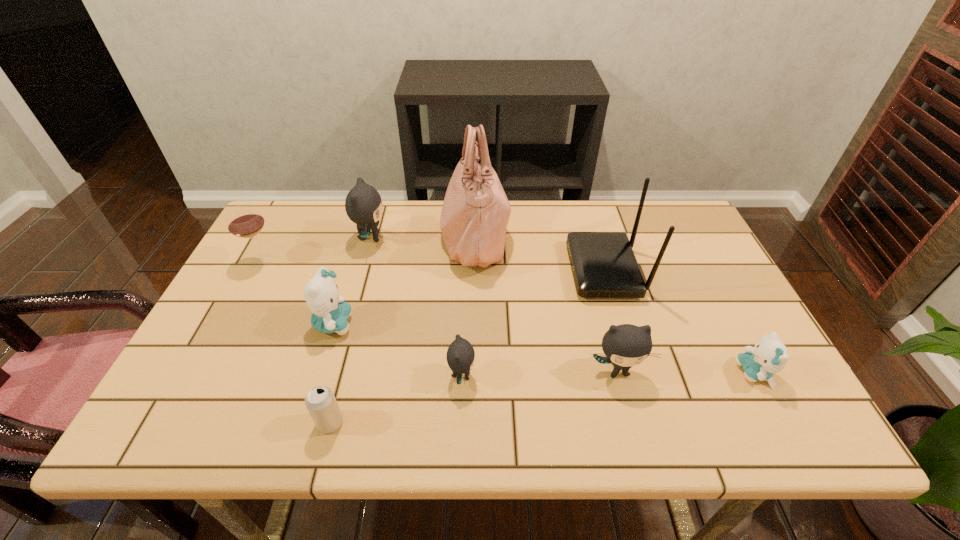
Choose which object is the third nearest neighbor to the rightmost object. Please provide its 2D coordinates. Your answer should be formatted as a tuple, i.e. [(x, y)], where the tuple contains the x and y coordinates of a point satisfying the conditions above.

[(475, 213)]

Point out which object is positioned as the second nearest to the handbag. Please provide its 2D coordinates. Your answer should be formatted as a tuple, i.e. [(x, y)], where the tuple contains the x and y coordinates of a point satisfying the conditions above.

[(603, 264)]

What are the coordinates of `kitten that is the fifth closest to the eighth shortest object` in the screenshot? It's located at (330, 314).

Image resolution: width=960 pixels, height=540 pixels. I want to click on kitten that is the second nearest to the smaller blue kitten, so click(x=460, y=356).

Locate which gray kitten is the closest to the nearest object. Please provide its 2D coordinates. Your answer should be formatted as a tuple, i.e. [(x, y)], where the tuple contains the x and y coordinates of a point satisfying the conditions above.

[(460, 356)]

Find the location of a particular element. The image size is (960, 540). the third closest gray kitten relative to the router is located at coordinates (363, 205).

This screenshot has width=960, height=540. Identify the location of vacant space that satisfies the following two spatial constraints: 1. on the front-facing side of the rightmost gray kitten; 2. on the front-facing side of the third kitten from left to right. pos(618,376).

I want to click on vacant region that satisfies the following two spatial constraints: 1. on the front-facing side of the second tallest object; 2. on the front-facing side of the rightmost gray kitten, so click(635, 371).